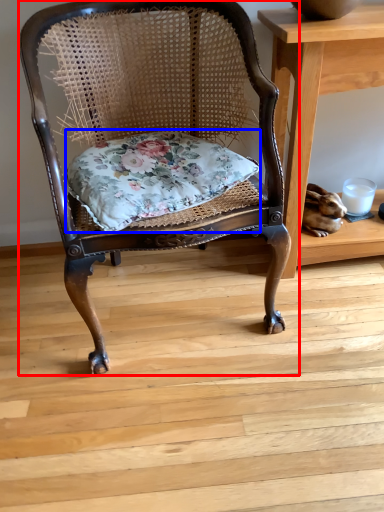
Question: Which point is further to the camera, chair (highlighted by a red box) or pillow (highlighted by a blue box)?

Choices:
 (A) chair
 (B) pillow

Answer: (B)